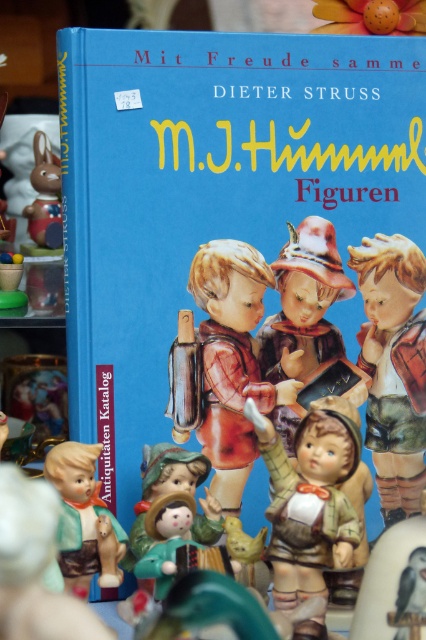
What are the coordinates of the matte porcelain child at center on the book cover?

The coordinates of the matte porcelain child at center are at point (x=232, y=360).

You are a collector who wants to display the matte brown figurine at center and the matte porcelain doll at lower left on a shelf. Which one should you place first if you want the taller item to be in the center?

The matte brown figurine at center is taller than the matte porcelain doll at lower left. To have the taller item in the center, you should place the matte brown figurine at center first.